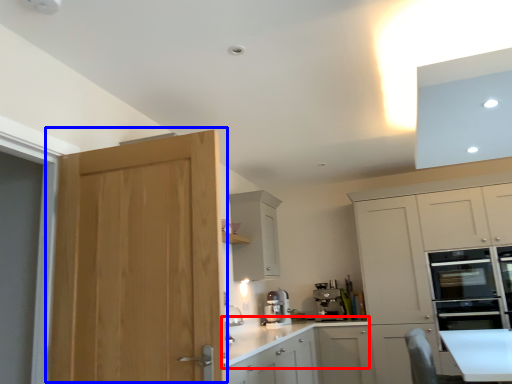
Question: Which object appears farthest to the camera in this image, countertop (highlighted by a red box) or door (highlighted by a blue box)?

Choices:
 (A) countertop
 (B) door

Answer: (A)